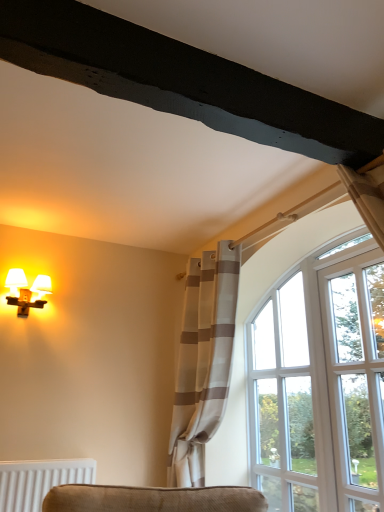
Question: Is point (297, 384) closer or farther from the camera than point (382, 374)?

Choices:
 (A) farther
 (B) closer

Answer: (A)

Question: Based on their sizes in the image, would you say clear glass window at upper right is bigger or smaller than clear glass door at right?

Choices:
 (A) big
 (B) small

Answer: (A)

Question: Which object is the farthest from the clear glass window at upper right?

Choices:
 (A) matte white sconce at left
 (B) white striped curtain at right
 (C) clear glass door at right

Answer: (A)

Question: Which object is positioned farthest from the clear glass door at right?

Choices:
 (A) clear glass window at upper right
 (B) matte white sconce at left
 (C) white striped curtain at right

Answer: (B)